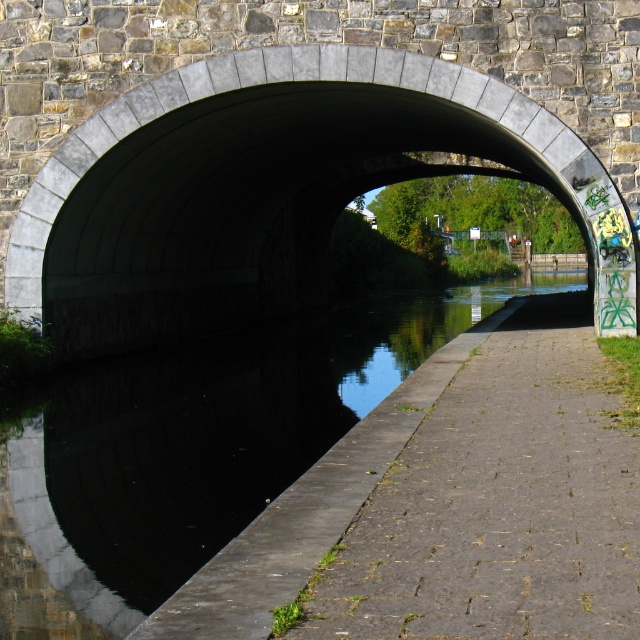
You are standing at the entrance of the canal and want to take a photo of the concrete archway at center. Based on your position, is the archway to your left, right, or directly ahead?

The concrete archway at center is located at point coordinates that place it directly ahead of your position at the entrance.

You are a tourist standing in front of the canal and want to take a photo of the concrete archway at center and the concrete paving at lower right. Which object will appear closer to you in the photo?

The concrete archway at center will appear closer to you in the photo because it is positioned further to the viewer than the concrete paving at lower right.

You are a boat operator planning to navigate a 10 meters long boat through the canal. The boat requires a width of 3 meters to pass safely. You observe the concrete archway at center and the black concrete water at center in the image. Can you determine if the canal is wide enough for your boat based on the given information?

The concrete archway at center might be wider than black concrete water at center, but without exact measurements, it is uncertain if the canal is wide enough for the boat requiring 3 meters width. Further information is needed.